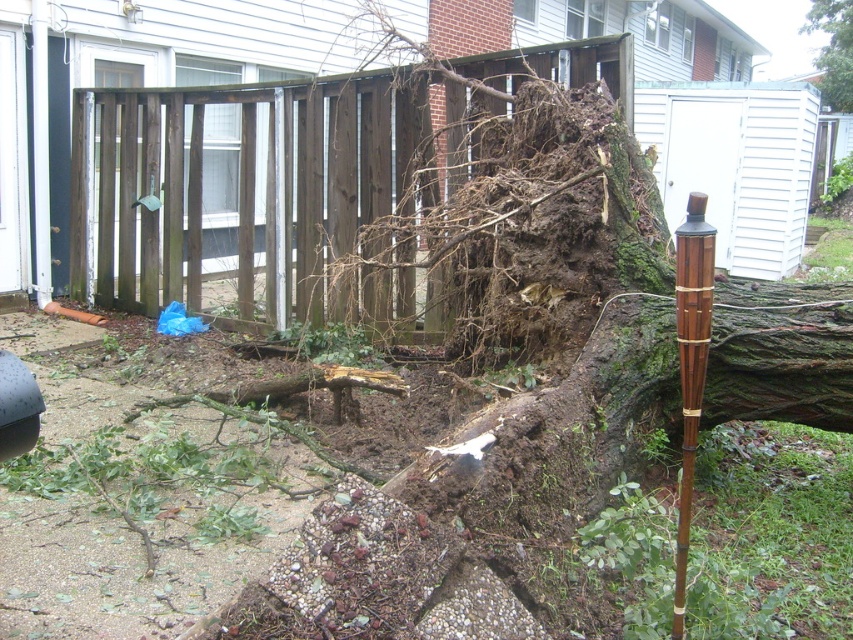
Question: Is brown bamboo pole at center smaller than green rough bark tree at upper right?

Choices:
 (A) no
 (B) yes

Answer: (B)

Question: Is brown wooden fence at center positioned behind brown bamboo pole at center?

Choices:
 (A) no
 (B) yes

Answer: (B)

Question: Which of the following is the closest to the observer?

Choices:
 (A) (683, 582)
 (B) (380, 256)

Answer: (A)

Question: Which point is farther to the camera?

Choices:
 (A) (825, 10)
 (B) (335, 300)
 (C) (685, 276)

Answer: (A)

Question: Is brown wooden fence at center further to the viewer compared to brown bamboo pole at center?

Choices:
 (A) no
 (B) yes

Answer: (B)

Question: Which of the following is the farthest from the observer?

Choices:
 (A) green rough bark tree at upper right
 (B) brown wooden fence at center
 (C) brown bamboo pole at center

Answer: (A)